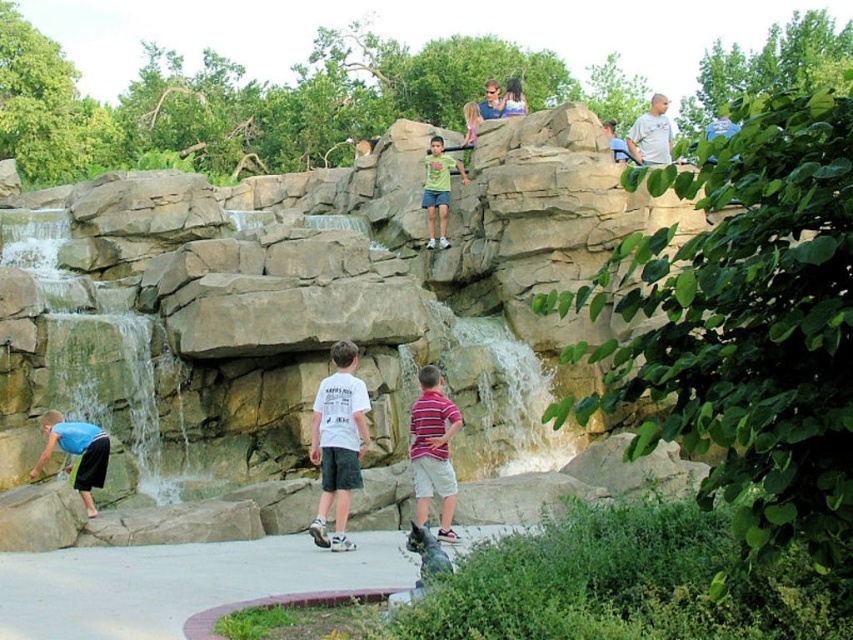
Is striped cotton shirt at center further to the viewer compared to blue matte skateboard at lower left?

No, striped cotton shirt at center is closer to the viewer.

Is striped cotton shirt at center closer to camera compared to blue matte skateboard at lower left?

Yes, striped cotton shirt at center is in front of blue matte skateboard at lower left.

The width and height of the screenshot is (853, 640). In order to click on striped cotton shirt at center in this screenshot , I will do `click(433, 449)`.

The width and height of the screenshot is (853, 640). What are the coordinates of `striped cotton shirt at center` in the screenshot? It's located at (433, 449).

Can you confirm if white cotton shirt at center is shorter than blue matte skateboard at lower left?

No.

Is white cotton shirt at center bigger than blue matte skateboard at lower left?

Yes.

Locate an element on the screen. The width and height of the screenshot is (853, 640). white cotton shirt at center is located at coordinates (338, 444).

Where is `white cotton shirt at center`? white cotton shirt at center is located at coordinates pos(338,444).

Does natural stone waterfall at upper center appear on the left side of striped cotton shirt at center?

Indeed, natural stone waterfall at upper center is positioned on the left side of striped cotton shirt at center.

The image size is (853, 640). Describe the element at coordinates (339, 301) in the screenshot. I see `natural stone waterfall at upper center` at that location.

Who is more forward, (413,132) or (434,451)?

Point (434,451)

You are a GUI agent. You are given a task and a screenshot of the screen. Output one action in this format:
    pyautogui.click(x=<x>, y=<y>)
    Task: Click on the natural stone waterfall at upper center
    This screenshot has width=853, height=640.
    Given the screenshot: What is the action you would take?
    pyautogui.click(x=339, y=301)